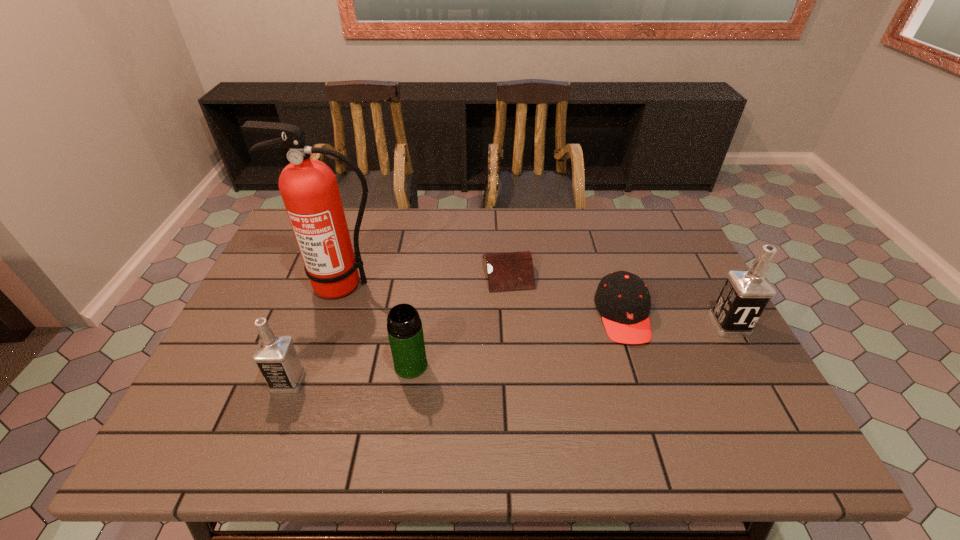
Locate an element on the screen. This screenshot has width=960, height=540. vacant area located 0.050m on the front label of the nearer vodka is located at coordinates (252, 381).

Where is `blank space located 0.070m on the front label of the nearer vodka`? blank space located 0.070m on the front label of the nearer vodka is located at coordinates (243, 381).

This screenshot has width=960, height=540. Find the location of `free region located on the front label of the taller vodka`. free region located on the front label of the taller vodka is located at coordinates (750, 363).

At what (x,y) coordinates should I click in order to perform the action: click on vacant space located on the handle side of the fire extinguisher. Please return your answer as a coordinate pair (x, y). Looking at the image, I should click on (314, 370).

Find the location of a particular element. The image size is (960, 540). free location located 0.080m on the front-facing side of the second shortest object is located at coordinates (642, 374).

Locate an element on the screen. The width and height of the screenshot is (960, 540). vacant space situated 0.060m on the left of the shortest object is located at coordinates (462, 272).

Locate an element on the screen. Image resolution: width=960 pixels, height=540 pixels. object at the far edge is located at coordinates [x=508, y=271].

You are a GUI agent. You are given a task and a screenshot of the screen. Output one action in this format:
    pyautogui.click(x=<x>, y=<y>)
    Task: Click on the vodka at the near edge
    Image resolution: width=960 pixels, height=540 pixels.
    Given the screenshot: What is the action you would take?
    pyautogui.click(x=275, y=355)

Find the location of `thermos bottle at the near edge`. thermos bottle at the near edge is located at coordinates (404, 326).

The height and width of the screenshot is (540, 960). In order to click on vodka that is at the left edge in this screenshot , I will do `click(275, 355)`.